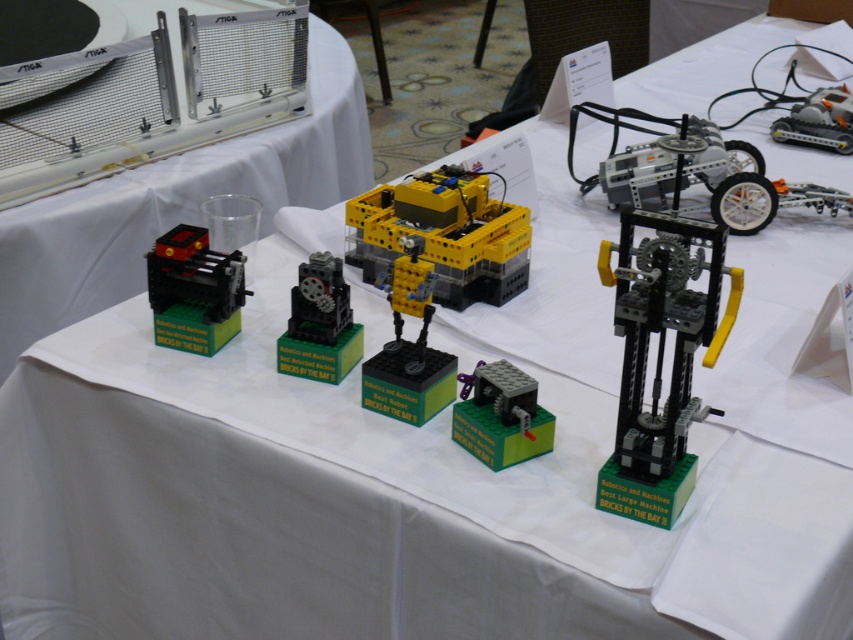
You are a judge at the LEGO robotics competition. You need to inspect the yellow plastic robot at center and the matte black gear at center. Which object is closer to you?

The yellow plastic robot at center is closer to you because the matte black gear at center is behind it.